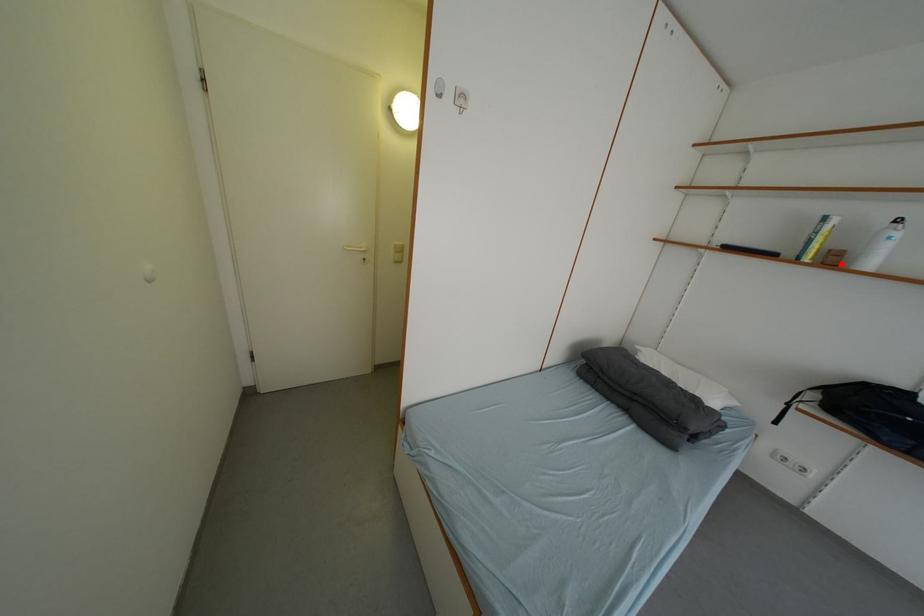
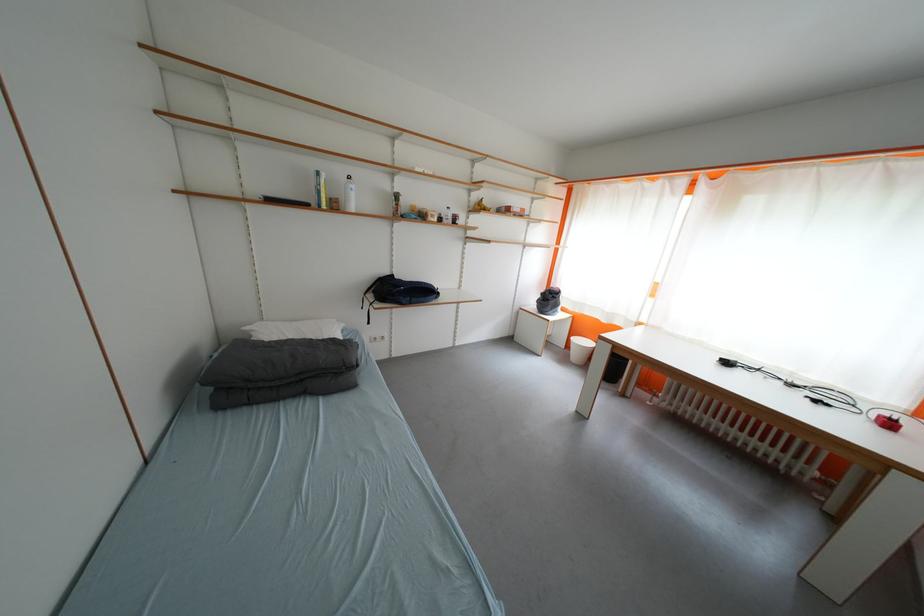
Question: I am providing you with two images of the same scene from different viewpoints. In image1, a red point is highlighted. Considering the same 3D point in image2, which of the following is correct?

Choices:
 (A) It is closer
 (B) It is farther

Answer: (A)